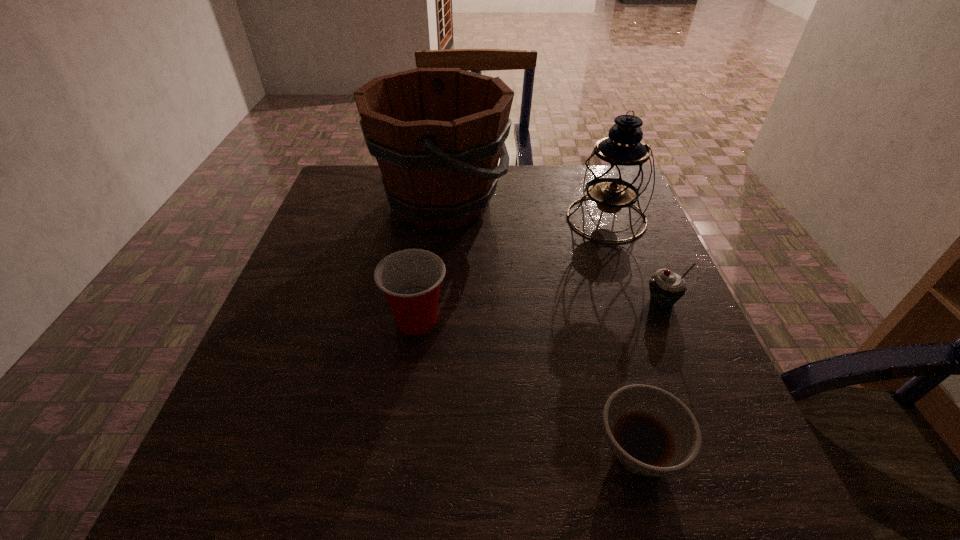
This screenshot has width=960, height=540. In order to click on free space that satisfies the following two spatial constraints: 1. on the back side of the nearest object; 2. on the handle side of the bucket in this screenshot , I will do `click(571, 203)`.

Where is `free spot that satisfies the following two spatial constraints: 1. on the front-facing side of the cupcake; 2. on the right side of the lantern`? The width and height of the screenshot is (960, 540). free spot that satisfies the following two spatial constraints: 1. on the front-facing side of the cupcake; 2. on the right side of the lantern is located at coordinates (636, 301).

At what (x,y) coordinates should I click in order to perform the action: click on vacant space that satisfies the following two spatial constraints: 1. on the handle side of the shortest object; 2. on the left side of the bucket. Please return your answer as a coordinate pair (x, y). Looking at the image, I should click on 413,451.

The height and width of the screenshot is (540, 960). What are the coordinates of `vacant space that satisfies the following two spatial constraints: 1. on the handle side of the bucket; 2. on the front side of the cup` in the screenshot? It's located at (428, 320).

This screenshot has height=540, width=960. Identify the location of free point that satisfies the following two spatial constraints: 1. on the handle side of the bucket; 2. on the left side of the soup bowl. (413, 451).

Identify the location of vacant space that satisfies the following two spatial constraints: 1. on the handle side of the bucket; 2. on the left side of the fourth tallest object. Image resolution: width=960 pixels, height=540 pixels. (430, 301).